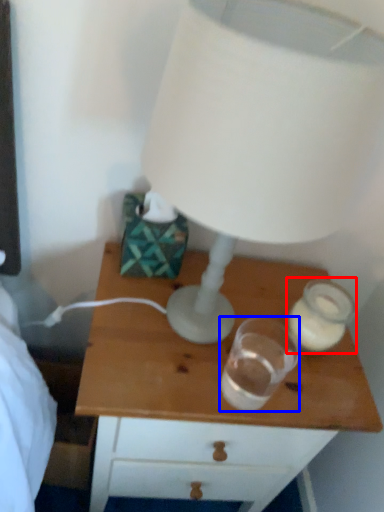
Question: Which of the following is the closest to the observer, candle holder (highlighted by a red box) or candle holder (highlighted by a blue box)?

Choices:
 (A) candle holder
 (B) candle holder

Answer: (B)